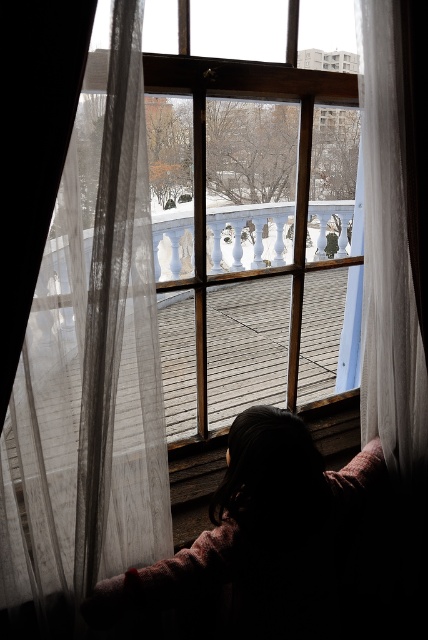
Question: In this image, where is silky pink sweater at lower center located relative to translucent fabric curtain at right?

Choices:
 (A) below
 (B) above

Answer: (A)

Question: Does sheer white curtain at left appear on the left side of translucent fabric curtain at right?

Choices:
 (A) no
 (B) yes

Answer: (B)

Question: Is sheer white curtain at left thinner than translucent fabric curtain at right?

Choices:
 (A) yes
 (B) no

Answer: (B)

Question: Estimate the real-world distances between objects in this image. Which object is closer to the sheer white curtain at left?

Choices:
 (A) translucent fabric curtain at right
 (B) silky pink sweater at lower center

Answer: (B)

Question: Among these points, which one is farthest from the camera?

Choices:
 (A) [377, 253]
 (B) [296, 486]

Answer: (A)

Question: Which point is closer to the camera taking this photo?

Choices:
 (A) (258, 586)
 (B) (136, 307)

Answer: (B)